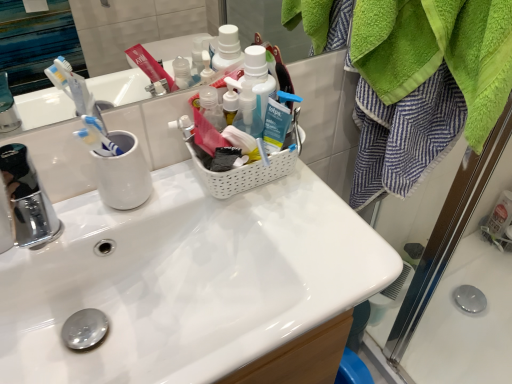
Describe the element at coordinates (187, 280) in the screenshot. I see `white glossy sink at center` at that location.

Locate an element on the screen. This screenshot has width=512, height=384. white glossy sink at center is located at coordinates (187, 280).

In order to click on white glossy sink at center in this screenshot , I will do `click(187, 280)`.